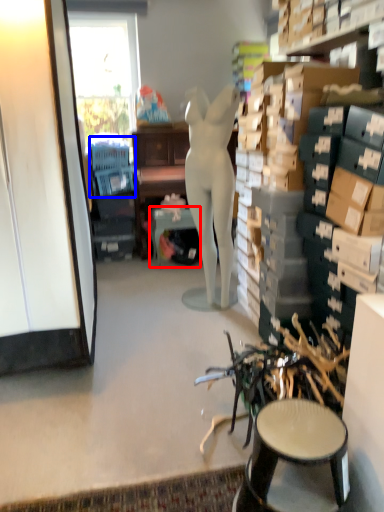
Question: Which point is further to the camera, table (highlighted by a red box) or swivel chair (highlighted by a blue box)?

Choices:
 (A) table
 (B) swivel chair

Answer: (B)